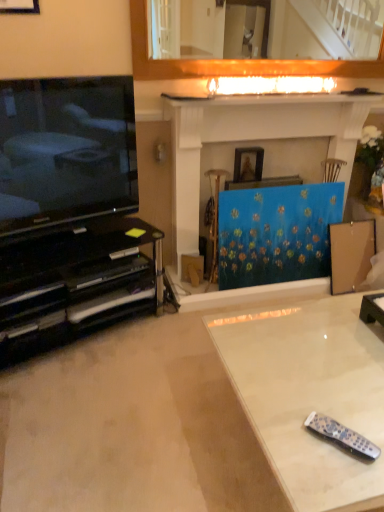
Find the location of a particular element. free space in front of brown cardboard box at center is located at coordinates (196, 307).